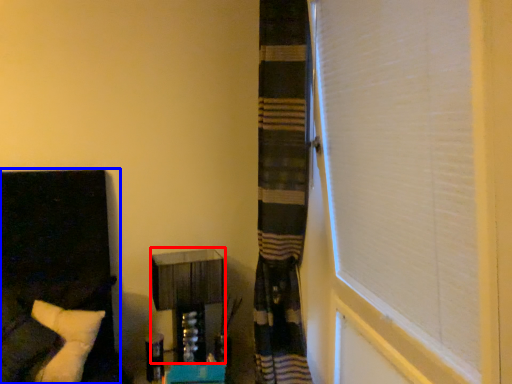
Question: Which object is further to the camera taking this photo, vanity (highlighted by a red box) or furniture (highlighted by a blue box)?

Choices:
 (A) vanity
 (B) furniture

Answer: (A)